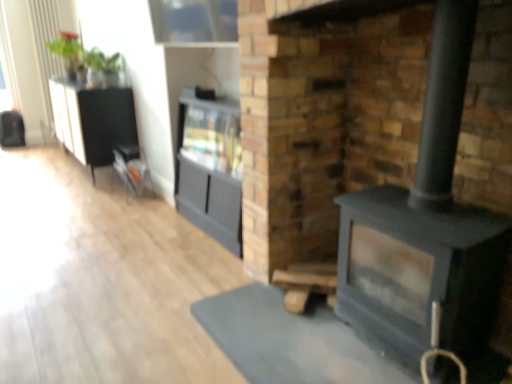
Question: Visually, is white glossy radiator at upper left positioned to the left or to the right of metallic silver magazine rack at left?

Choices:
 (A) left
 (B) right

Answer: (A)

Question: From the image's perspective, is white glossy radiator at upper left positioned above or below metallic silver magazine rack at left?

Choices:
 (A) below
 (B) above

Answer: (B)

Question: Estimate the real-world distances between objects in this image. Which object is closer to the black textured cabinet at left, which ranks as the 1th entertainment center in back-to-front order?

Choices:
 (A) white glossy radiator at upper left
 (B) matte black fireplace at center
 (C) matte gray cabinet at center, acting as the 1th entertainment center starting from the right
 (D) metallic silver magazine rack at left

Answer: (D)

Question: Considering the real-world distances, which object is farthest from the white glossy radiator at upper left?

Choices:
 (A) matte gray cabinet at center, the second entertainment center positioned from the left
 (B) black textured cabinet at left, positioned as the 2th entertainment center in front-to-back order
 (C) matte black fireplace at center
 (D) metallic silver magazine rack at left

Answer: (C)